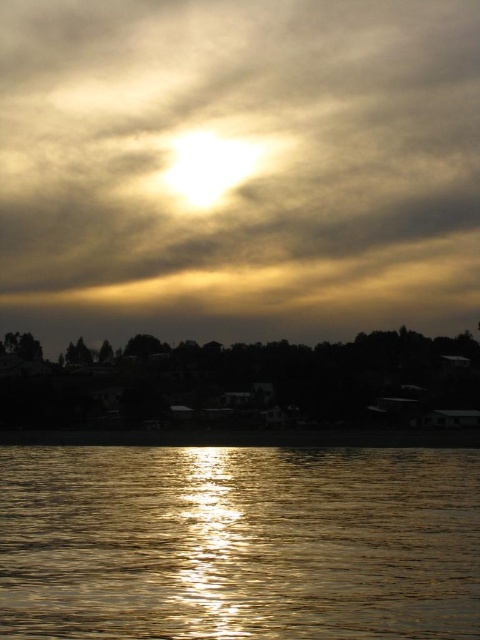
You are an artist painting the sunset scene. You need to decide which object to paint first based on their sizes. Which has a larger width, the golden translucent cloud at upper center or the dark matte trees at lower center?

The golden translucent cloud at upper center has a larger width than the dark matte trees at lower center according to the description.